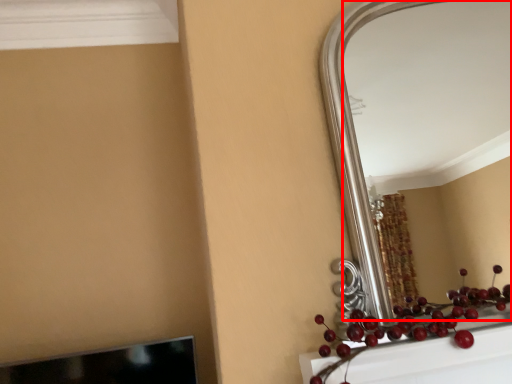
Question: From the image's perspective, where is mirror (annotated by the red box) located relative to fruit?

Choices:
 (A) below
 (B) above

Answer: (B)